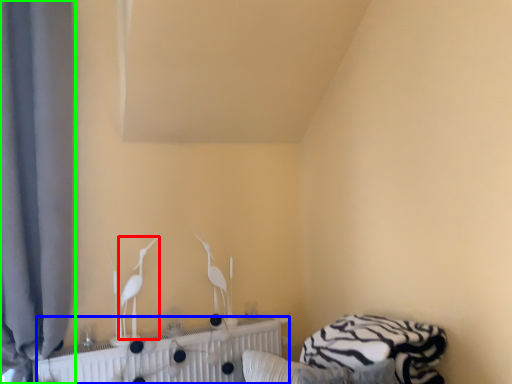
Question: Which object is positioned closest to bird (highlighted by a red box)? Select from radiator (highlighted by a blue box) and curtain (highlighted by a green box).

Choices:
 (A) radiator
 (B) curtain

Answer: (A)